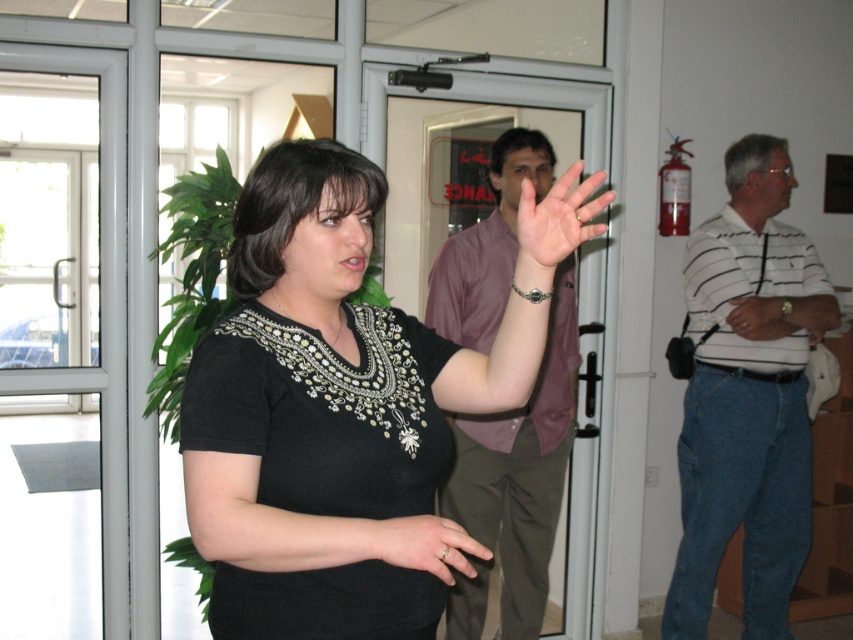
Question: Is white striped shirt at right to the left of black matte ring at center from the viewer's perspective?

Choices:
 (A) no
 (B) yes

Answer: (A)

Question: Which point is closer to the camera taking this photo?

Choices:
 (A) (370, 410)
 (B) (756, 595)

Answer: (A)

Question: Which point appears farthest from the camera in this image?

Choices:
 (A) (x=328, y=168)
 (B) (x=80, y=374)
 (C) (x=431, y=522)
 (D) (x=595, y=202)

Answer: (B)

Question: Is white striped shirt at right positioned at the back of skinny white hand at center?

Choices:
 (A) no
 (B) yes

Answer: (B)

Question: Does black matte shirt at center have a larger size compared to brown leather watch at upper right?

Choices:
 (A) yes
 (B) no

Answer: (A)

Question: Estimate the real-world distances between objects in this image. Which object is closer to the brown leather watch at upper right?

Choices:
 (A) white striped polo shirt at right
 (B) skinny white hand at center
 (C) black matte shirt at center
 (D) white striped shirt at right

Answer: (A)